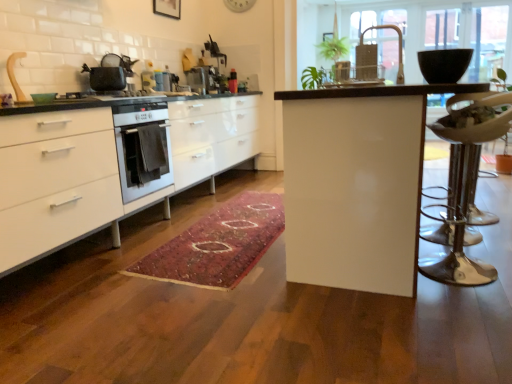
Question: Is matte black pot at upper left inside or outside of metallic silver swivel chair at right?

Choices:
 (A) outside
 (B) inside

Answer: (A)

Question: From their relative heights in the image, would you say matte black pot at upper left is taller or shorter than metallic silver swivel chair at right?

Choices:
 (A) tall
 (B) short

Answer: (B)

Question: Estimate the real-world distances between objects in this image. Which object is closer to the metallic silver swivel chair at right?

Choices:
 (A) white glossy cabinets at left
 (B) metallic silver toaster at center, which is the 1th appliance from back to front
 (C) metallic silver toaster at center, which appears as the 2th appliance when viewed from the back
 (D) metallic gold faucet at upper center
 (E) matte black pot at upper left

Answer: (A)

Question: Which of these objects is positioned closest to the white glossy table at center?

Choices:
 (A) matte black pot at upper left
 (B) black glossy mixing bowl at upper right
 (C) wooden picture frame at upper center
 (D) metallic gold faucet at upper center
 (E) metallic silver swivel chair at right

Answer: (E)